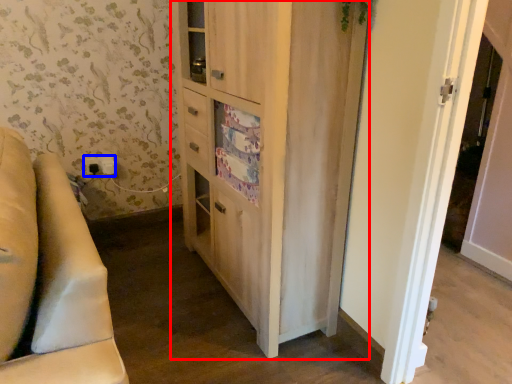
Question: Which point is closer to the camera, cabinetry (highlighted by a red box) or electric outlet (highlighted by a blue box)?

Choices:
 (A) cabinetry
 (B) electric outlet

Answer: (A)